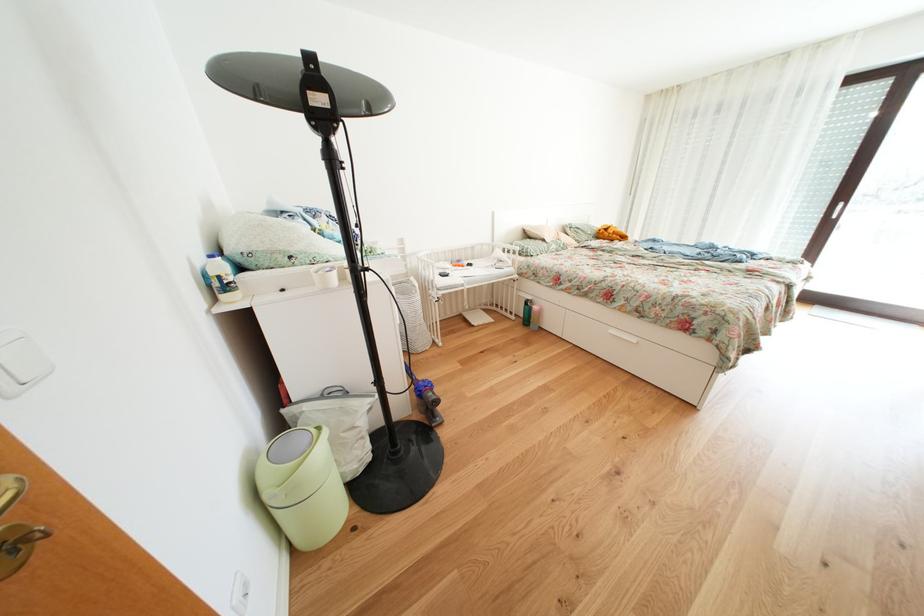
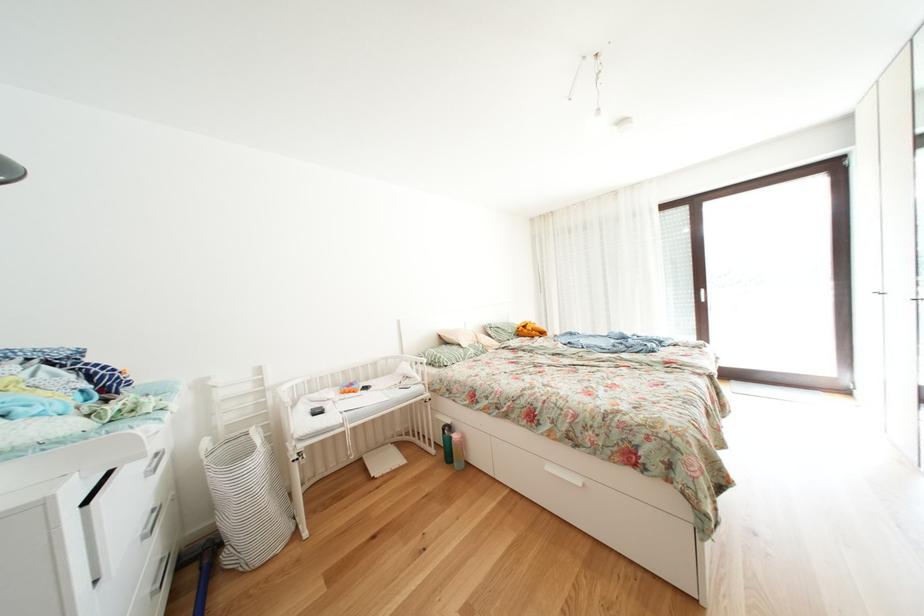
In the second image, find the point that corresponds to (523,323) in the first image.

(443, 456)